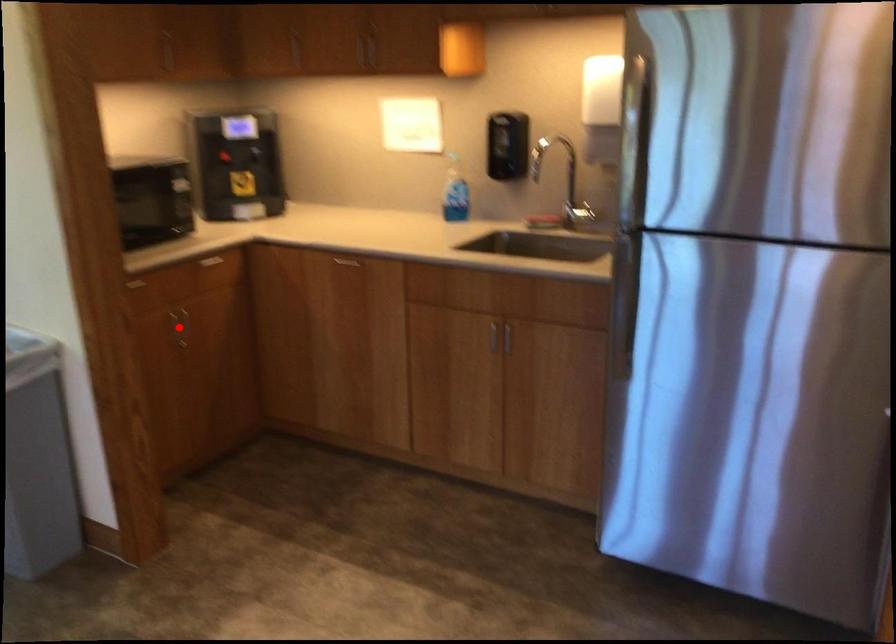
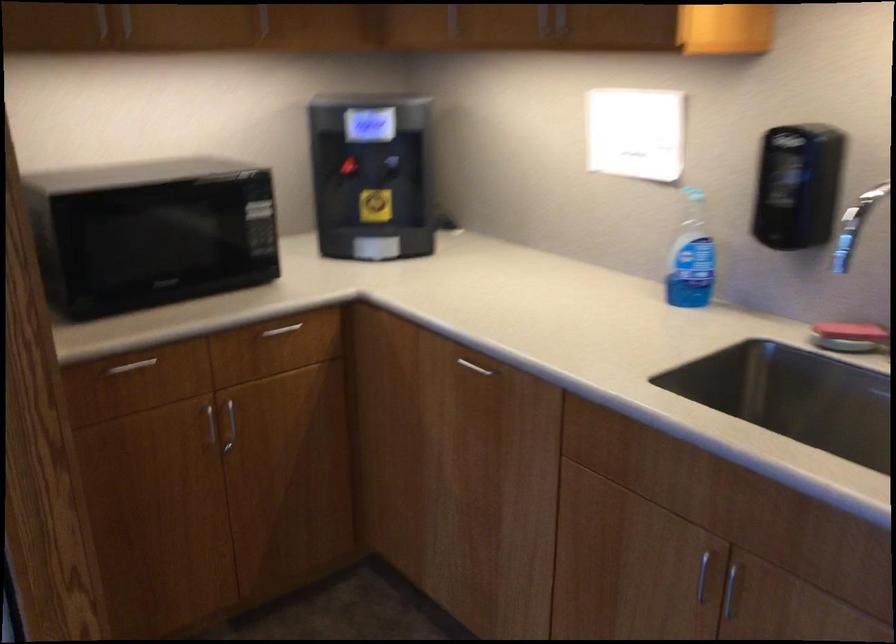
The point at the highlighted location is marked in the first image. Where is the corresponding point in the second image?

(229, 426)